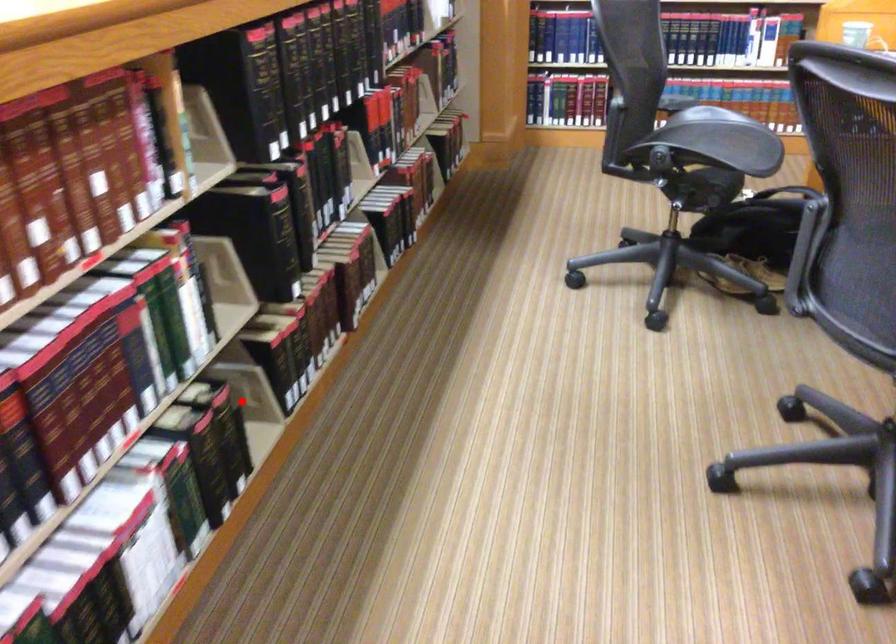
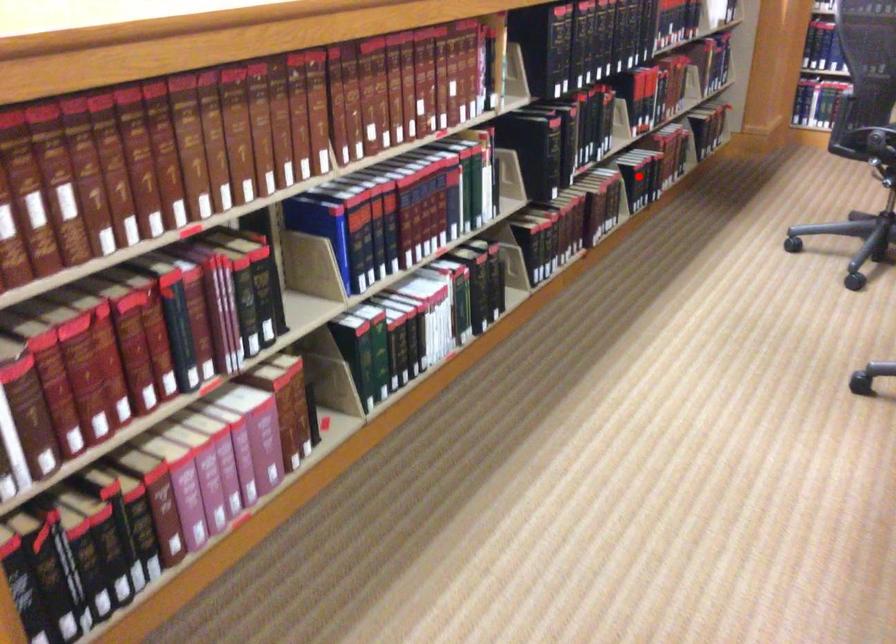
I am providing you with two images of the same scene from different viewpoints. A red point is marked on the first image and another point is marked on the second image. Are the points marked in image1 and image2 representing the same 3D position?

No